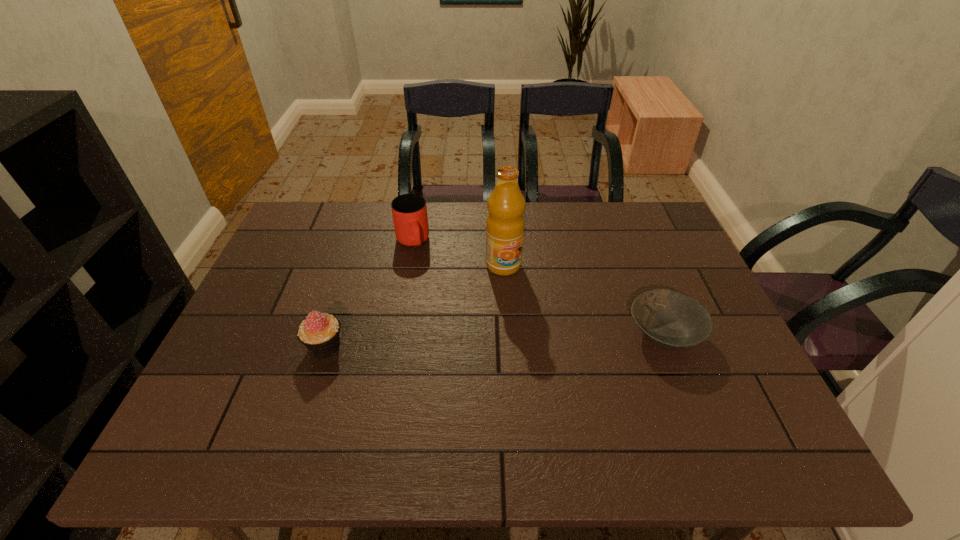
In order to click on the leftmost object in this screenshot , I will do `click(320, 333)`.

The image size is (960, 540). I want to click on the shortest object, so click(671, 320).

This screenshot has height=540, width=960. I want to click on the rightmost object, so [671, 320].

This screenshot has width=960, height=540. Identify the location of cup. (409, 211).

Locate an element on the screen. The image size is (960, 540). the third object from left to right is located at coordinates (505, 224).

This screenshot has width=960, height=540. In order to click on fruit juice in this screenshot , I will do `click(505, 224)`.

The width and height of the screenshot is (960, 540). I want to click on vacant space situated on the left of the leftmost object, so click(x=260, y=347).

Locate an element on the screen. The height and width of the screenshot is (540, 960). free spot located 0.370m on the back of the bowl is located at coordinates (621, 225).

Locate an element on the screen. The image size is (960, 540). free space located on the handle side of the third object from right to left is located at coordinates (419, 267).

Find the location of a particular element. This screenshot has width=960, height=540. vacant space positioned on the handle side of the third object from right to left is located at coordinates (451, 358).